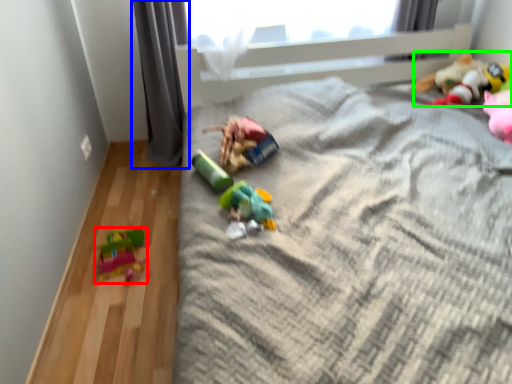
Question: Which object is the farthest from toy (highlighted by a red box)? Choose among these: curtain (highlighted by a blue box) or toy (highlighted by a green box).

Choices:
 (A) curtain
 (B) toy

Answer: (B)